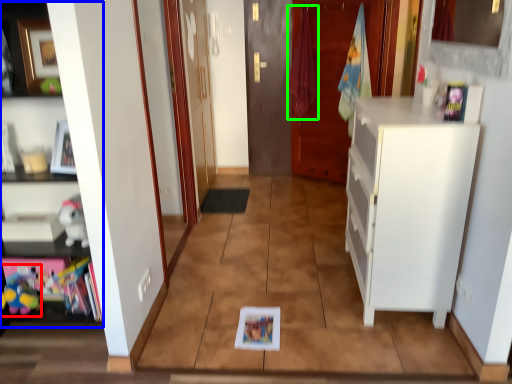
Question: Based on their relative distances, which object is nearer to toy (highlighted by a red box)? Choose from cabinetry (highlighted by a blue box) and laundry (highlighted by a green box).

Choices:
 (A) cabinetry
 (B) laundry

Answer: (A)